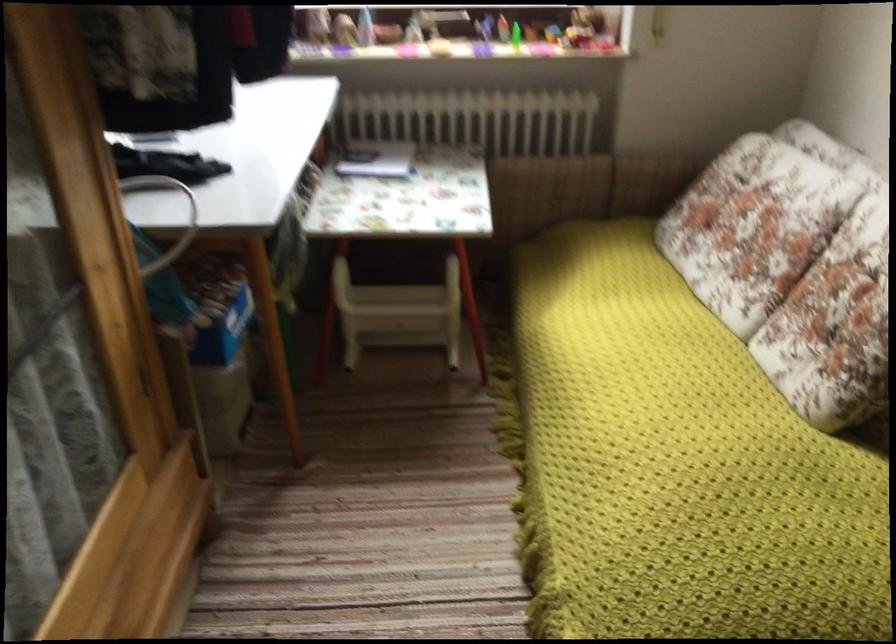
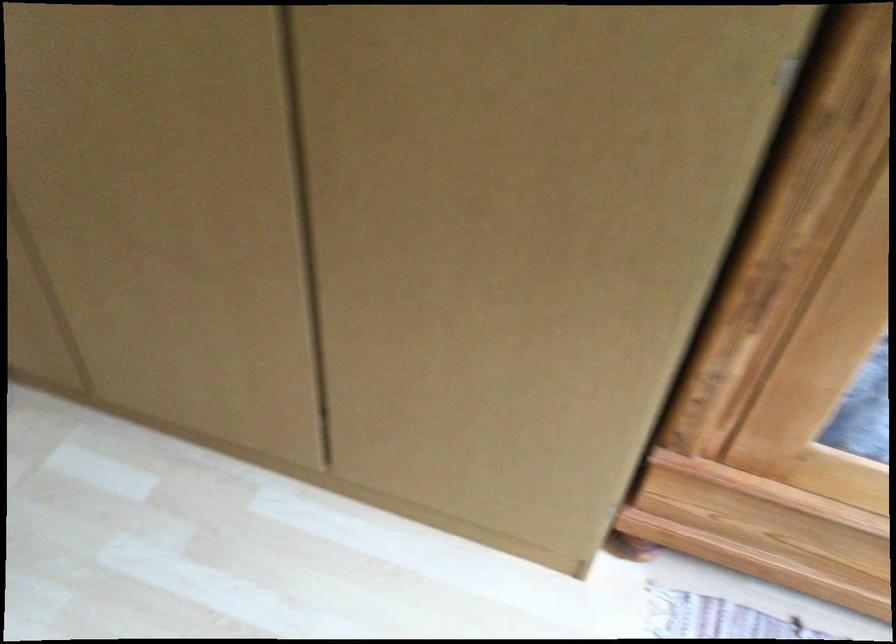
The first image is from the beginning of the video and the second image is from the end. How did the camera likely rotate when shooting the video?

The camera's rotation is toward left-down.